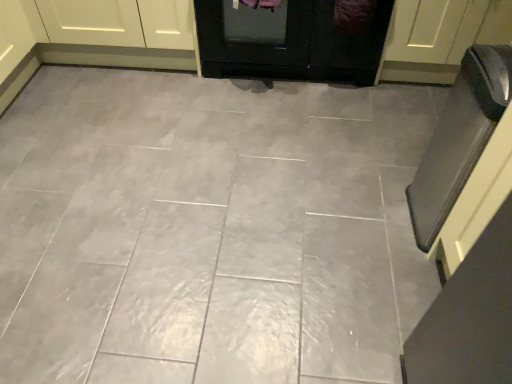
Identify the location of black glass oven at right. (459, 137).

What do you see at coordinates (209, 229) in the screenshot?
I see `gray glossy tile at center` at bounding box center [209, 229].

What do you see at coordinates (117, 33) in the screenshot? I see `matte white cabinet at upper left` at bounding box center [117, 33].

This screenshot has width=512, height=384. Find the location of `black glass oven at right`. black glass oven at right is located at coordinates (459, 137).

Is matte white cabinet at upper left wider than black glass oven at right?

Yes.

Who is shorter, matte white cabinet at upper left or black glass oven at right?

Standing shorter between the two is matte white cabinet at upper left.

Is point (186, 42) positioned after point (509, 47)?

Yes, it is.

Is matte white cabinet at upper left aimed at black glass oven at right?

No.

From the image's perspective, does matte white cabinet at upper left appear lower than gray glossy tile at center?

No, from the image's perspective, matte white cabinet at upper left is not below gray glossy tile at center.

Find the location of a particular element. The image size is (512, 384). ceramic tile located on the right of matte white cabinet at upper left is located at coordinates point(209,229).

Could you tell me if matte white cabinet at upper left is facing gray glossy tile at center?

Yes.

Does point (63, 50) lie behind point (385, 118)?

Yes, point (63, 50) is farther from viewer.

Considering the sizes of objects black glossy door at center, the second door in the right-to-left sequence, and gray glossy tile at center in the image provided, who is smaller, black glossy door at center, the second door in the right-to-left sequence, or gray glossy tile at center?

black glossy door at center, the second door in the right-to-left sequence.

Is the position of black glossy door at center, marked as the first door in a left-to-right arrangement, less distant than that of gray glossy tile at center?

No, it is behind gray glossy tile at center.

Is black glossy door at center, the second door in the right-to-left sequence, aimed at gray glossy tile at center?

Yes, black glossy door at center, the second door in the right-to-left sequence, faces towards gray glossy tile at center.

Consider the image. Is black glossy door at center, marked as the first door in a left-to-right arrangement, at the left side of gray glossy tile at center?

No, black glossy door at center, marked as the first door in a left-to-right arrangement, is not to the left of gray glossy tile at center.

Which object is further away from the camera, black glass oven at right or matte white cabinet at upper left?

matte white cabinet at upper left is further from the camera.

What's the angular difference between black glass oven at right and matte white cabinet at upper left's facing directions?

The angle between the facing direction of black glass oven at right and the facing direction of matte white cabinet at upper left is 178 degrees.

From the image's perspective, is black glass oven at right located above or below matte white cabinet at upper left?

Clearly, from the image's perspective, black glass oven at right is below matte white cabinet at upper left.

From a real-world perspective, is black glass oven at right positioned above or below matte white cabinet at upper left?

Clearly, from a real-world perspective, black glass oven at right is above matte white cabinet at upper left.

Considering the relative sizes of gray glossy tile at center and black glass oven at right in the image provided, is gray glossy tile at center smaller than black glass oven at right?

Actually, gray glossy tile at center might be larger than black glass oven at right.

Which of these two, gray glossy tile at center or black glass oven at right, is wider?

gray glossy tile at center is wider.

Which is in front, gray glossy tile at center or black glass oven at right?

black glass oven at right is closer to the camera.

Is gray glossy tile at center far away from black glass oven at right?

No, gray glossy tile at center is in close proximity to black glass oven at right.

Is black glass oven at right closer to the viewer compared to black glossy door at center, the second door in the right-to-left sequence?

Yes, it is.

Is black glass oven at right next to black glossy door at center, marked as the first door in a left-to-right arrangement?

black glass oven at right is not next to black glossy door at center, marked as the first door in a left-to-right arrangement, and they're not touching.

Is black glass oven at right oriented away from black glossy door at center, marked as the first door in a left-to-right arrangement?

No, black glossy door at center, marked as the first door in a left-to-right arrangement, is not at the back of black glass oven at right.

From the image's perspective, does gray glossy tile at center appear higher than black glossy door at center, the second door in the right-to-left sequence?

No, from the image's perspective, gray glossy tile at center is not on top of black glossy door at center, the second door in the right-to-left sequence.

Based on the photo, is gray glossy tile at center thinner than black glossy door at center, marked as the first door in a left-to-right arrangement?

Incorrect, the width of gray glossy tile at center is not less than that of black glossy door at center, marked as the first door in a left-to-right arrangement.

How much distance is there between gray glossy tile at center and black glossy door at center, marked as the first door in a left-to-right arrangement?

gray glossy tile at center is 27.72 inches away from black glossy door at center, marked as the first door in a left-to-right arrangement.

Is gray glossy tile at center looking in the opposite direction of black glossy door at center, the second door in the right-to-left sequence?

No.

Where is `oven below the matte white cabinet at upper left (from the image's perspective)`? oven below the matte white cabinet at upper left (from the image's perspective) is located at coordinates (459, 137).

Find the location of a particular element. The width and height of the screenshot is (512, 384). ceramic tile on the right of matte white cabinet at upper left is located at coordinates (209, 229).

When comparing their distances from white glossy door at upper right, the second door when ordered from left to right, does gray glossy tile at center or matte white cabinet at upper left seem closer?

The object closer to white glossy door at upper right, the second door when ordered from left to right, is gray glossy tile at center.

When comparing their distances from gray glossy tile at center, does black glossy door at center, the second door in the right-to-left sequence, or white glossy door at upper right, which appears as the first door when viewed from the right, seem closer?

The object closer to gray glossy tile at center is black glossy door at center, the second door in the right-to-left sequence.

Which object lies nearer to the anchor point matte white cabinet at upper left, gray glossy tile at center or black glass oven at right?

The object closer to matte white cabinet at upper left is gray glossy tile at center.

When comparing their distances from black glossy door at center, the second door in the right-to-left sequence, does white glossy door at upper right, the second door when ordered from left to right, or matte white cabinet at upper left seem closer?

white glossy door at upper right, the second door when ordered from left to right, is closer to black glossy door at center, the second door in the right-to-left sequence.

Considering their positions, is white glossy door at upper right, which appears as the first door when viewed from the right, positioned further to matte white cabinet at upper left than black glossy door at center, the second door in the right-to-left sequence?

white glossy door at upper right, which appears as the first door when viewed from the right, is positioned further to the anchor matte white cabinet at upper left.

Based on their spatial positions, is matte white cabinet at upper left or black glass oven at right further from white glossy door at upper right, which appears as the first door when viewed from the right?

Among the two, matte white cabinet at upper left is located further to white glossy door at upper right, which appears as the first door when viewed from the right.

When comparing their distances from white glossy door at upper right, which appears as the first door when viewed from the right, does black glossy door at center, the second door in the right-to-left sequence, or black glass oven at right seem closer?

black glossy door at center, the second door in the right-to-left sequence, lies closer to white glossy door at upper right, which appears as the first door when viewed from the right, than the other object.

Looking at the image, which one is located closer to black glass oven at right, matte white cabinet at upper left or white glossy door at upper right, which appears as the first door when viewed from the right?

The object closer to black glass oven at right is white glossy door at upper right, which appears as the first door when viewed from the right.

Where is `door situated between matte white cabinet at upper left and white glossy door at upper right, the second door when ordered from left to right, from left to right`? This screenshot has height=384, width=512. door situated between matte white cabinet at upper left and white glossy door at upper right, the second door when ordered from left to right, from left to right is located at coordinates (292, 39).

You are a GUI agent. You are given a task and a screenshot of the screen. Output one action in this format:
    pyautogui.click(x=<x>, y=<y>)
    Task: Click on the oven located between matte white cabinet at upper left and white glossy door at upper right, which appears as the first door when viewed from the right, in the left-right direction
    Image resolution: width=512 pixels, height=384 pixels.
    Given the screenshot: What is the action you would take?
    pyautogui.click(x=459, y=137)

Identify the location of door between black glass oven at right and black glossy door at center, the second door in the right-to-left sequence, along the z-axis. The width and height of the screenshot is (512, 384). (429, 39).

Locate an element on the screen. door located between gray glossy tile at center and white glossy door at upper right, which appears as the first door when viewed from the right, in the left-right direction is located at coordinates (292, 39).